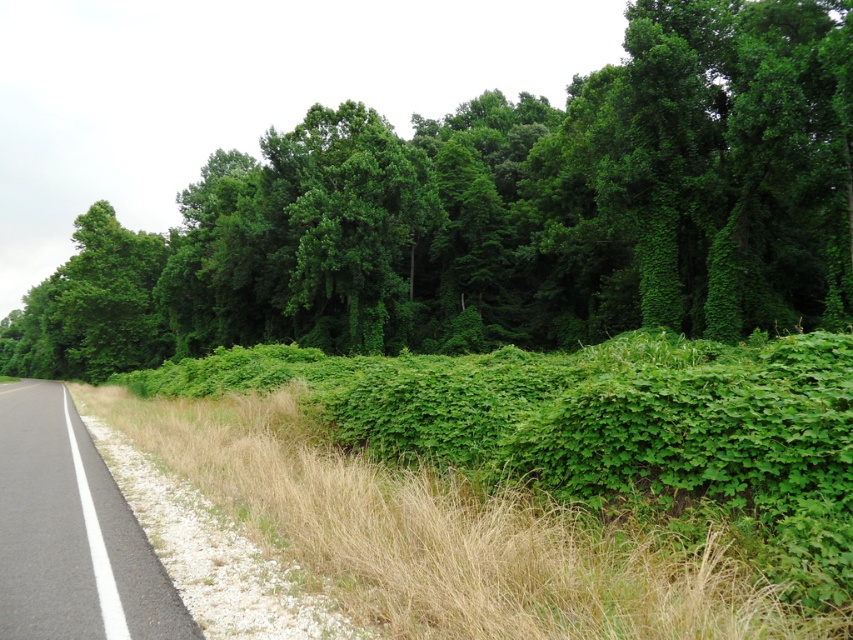
You are a gardener trying to determine which plant to prune first. You see a green leafy bush at center and a green leafy grass at center. Based on their widths, which one should you tackle first?

The green leafy bush at center might be wider than green leafy grass at center, so you should prune the bush first to ensure it doesn

You are driving along the road and see two points marked on your GPS. The first point is at coordinate point (792,321) and the second point is at coordinate point (27,589). Which point is closer to your current position if you are driving towards the direction of the road?

Point (27,589) is closer to your current position because it is ahead in the direction of travel, while point (792,321) is behind you.